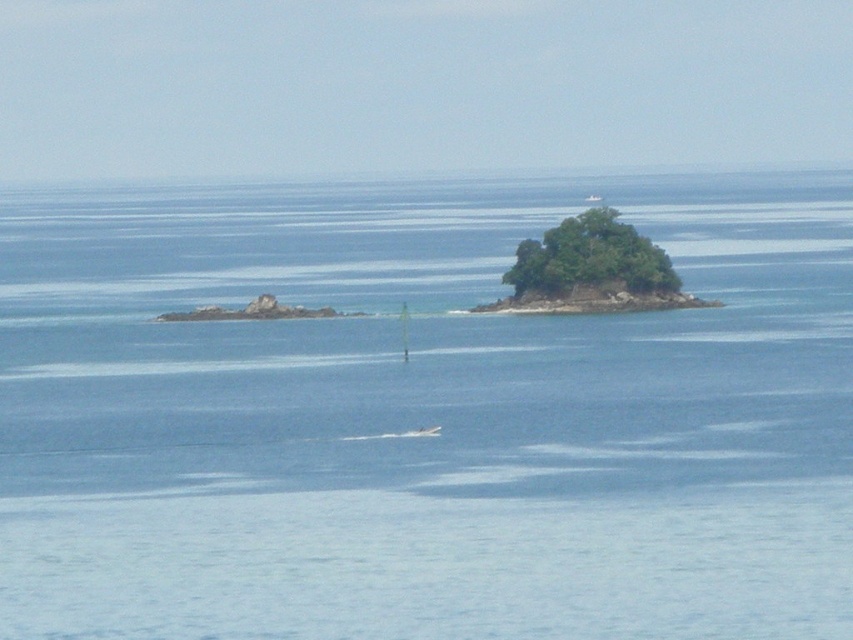
Does point (608, 269) come in front of point (268, 308)?

No.

Who is positioned more to the left, green leafy island at center or green mossy rock at left?

green mossy rock at left

Between point (593, 236) and point (287, 307), which one is positioned in front?

Positioned in front is point (287, 307).

The height and width of the screenshot is (640, 853). I want to click on green leafy island at center, so click(590, 269).

Who is positioned more to the left, green mossy rock at left or white plastic boat at center?

green mossy rock at left is more to the left.

Describe the element at coordinates (254, 310) in the screenshot. I see `green mossy rock at left` at that location.

Where is `green mossy rock at left`? Image resolution: width=853 pixels, height=640 pixels. green mossy rock at left is located at coordinates (254, 310).

You are a GUI agent. You are given a task and a screenshot of the screen. Output one action in this format:
    pyautogui.click(x=<x>, y=<y>)
    Task: Click on the green mossy rock at left
    The image size is (853, 640).
    Given the screenshot: What is the action you would take?
    pyautogui.click(x=254, y=310)

Is blue water at center to the right of green leafy island at center from the viewer's perspective?

In fact, blue water at center is to the left of green leafy island at center.

Between point (100, 467) and point (560, 275), which one is positioned behind?

Point (560, 275)

At what (x,y) coordinates should I click in order to perform the action: click on blue water at center. Please return your answer as a coordinate pair (x, y). Image resolution: width=853 pixels, height=640 pixels. Looking at the image, I should click on (422, 419).